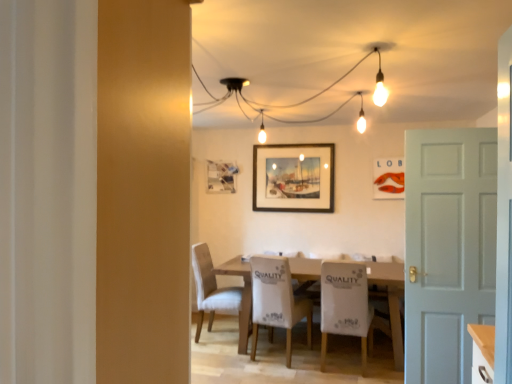
Measure the distance between point [400,265] and camera.

Point [400,265] and camera are 4.19 meters apart from each other.

Measure the distance between point (277, 314) and camera.

The depth of point (277, 314) is 12.40 feet.

The height and width of the screenshot is (384, 512). What do you see at coordinates (277, 301) in the screenshot?
I see `white fabric chair at center, which is the 2th chair from right to left` at bounding box center [277, 301].

In order to face white fabric chair at center, which is the first chair from right to left, should I rotate leftwards or rightwards?

It's best to rotate right around 11.982 degrees.

Locate an element on the screen. matte glass picture frame at center, which is counted as the 1th picture frame, starting from the back is located at coordinates 221,177.

Is matte glass picture frame at center, acting as the 3th picture frame starting from the front, to the left of white matte door at right from the viewer's perspective?

Yes, matte glass picture frame at center, acting as the 3th picture frame starting from the front, is to the left of white matte door at right.

Does point (220, 163) appear closer or farther from the camera than point (453, 159)?

Point (220, 163) is farther from the camera than point (453, 159).

The width and height of the screenshot is (512, 384). What are the coordinates of `the 3rd picture frame positioned above the white matte door at right (from a real-world perspective)` in the screenshot? It's located at (221, 177).

Measure the distance between matte glass picture frame at center, acting as the 3th picture frame starting from the front, and white matte door at right.

A distance of 9.19 feet exists between matte glass picture frame at center, acting as the 3th picture frame starting from the front, and white matte door at right.

Between point (270, 270) and point (210, 174), which one is positioned in front?

The point (270, 270) is closer to the camera.

How many degrees apart are the facing directions of white fabric chair at center, which is the 2th chair from right to left, and matte glass picture frame at center, which is counted as the 1th picture frame, starting from the back?

They differ by 171 degrees in their facing directions.

From a real-world perspective, between white fabric chair at center, placed as the second chair when sorted from left to right, and matte glass picture frame at center, which is counted as the 1th picture frame, starting from the back, who is vertically higher?

matte glass picture frame at center, which is counted as the 1th picture frame, starting from the back.

Could matte glass picture frame at center, acting as the 3th picture frame starting from the front, be considered to be inside white fabric chair at center, placed as the second chair when sorted from left to right?

No, matte glass picture frame at center, acting as the 3th picture frame starting from the front, is located outside of white fabric chair at center, placed as the second chair when sorted from left to right.

Is white fabric chair at center, which is the 2th chair from right to left, taller than white matte door at right?

In fact, white fabric chair at center, which is the 2th chair from right to left, may be shorter than white matte door at right.

Is white fabric chair at center, which is the 2th chair from right to left, in contact with white matte door at right?

No, white fabric chair at center, which is the 2th chair from right to left, is not next to white matte door at right.

Is white fabric chair at center, which is the 2th chair from right to left, not within white matte door at right?

Yes, white fabric chair at center, which is the 2th chair from right to left, is located beyond the bounds of white matte door at right.

From a real-world perspective, is white fabric chair at center, which is the 2th chair from right to left, positioned above or below white matte door at right?

white fabric chair at center, which is the 2th chair from right to left, is situated lower than white matte door at right in the real world.

Which of these two, white fabric chair at center, which is the first chair from right to left, or matte glass picture frame at center, acting as the 3th picture frame starting from the front, is bigger?

With larger size is white fabric chair at center, which is the first chair from right to left.

From a real-world perspective, is white fabric chair at center, which is the first chair from right to left, on top of matte glass picture frame at center, which appears as the third picture frame when viewed from the right?

Actually, white fabric chair at center, which is the first chair from right to left, is physically below matte glass picture frame at center, which appears as the third picture frame when viewed from the right, in the real world.

Where is `the 3rd chair in front of the matte glass picture frame at center, which is counted as the 1th picture frame, starting from the back, starting your count from the anchor`? the 3rd chair in front of the matte glass picture frame at center, which is counted as the 1th picture frame, starting from the back, starting your count from the anchor is located at coordinates (345, 306).

Which object is positioned more to the left, white matte door at right or white fabric chair at center, placed as the second chair when sorted from left to right?

Positioned to the left is white fabric chair at center, placed as the second chair when sorted from left to right.

Consider the image. Is white matte door at right not near white fabric chair at center, which is the 2th chair from right to left?

Absolutely, white matte door at right is distant from white fabric chair at center, which is the 2th chair from right to left.

From a real-world perspective, between white matte door at right and white fabric chair at center, placed as the second chair when sorted from left to right, who is vertically lower?

From a 3D spatial view, white fabric chair at center, placed as the second chair when sorted from left to right, is below.

Where is `door in front of the white fabric chair at center, which is the 2th chair from right to left`? The image size is (512, 384). door in front of the white fabric chair at center, which is the 2th chair from right to left is located at coordinates (448, 248).

Consider the image. Considering the relative sizes of white fabric chair at center, which is the 2th chair from right to left, and wooden framed painting at center, which ranks as the 2th picture frame in front-to-back order, in the image provided, is white fabric chair at center, which is the 2th chair from right to left, bigger than wooden framed painting at center, which ranks as the 2th picture frame in front-to-back order,?

Correct, white fabric chair at center, which is the 2th chair from right to left, is larger in size than wooden framed painting at center, which ranks as the 2th picture frame in front-to-back order.

Considering the relative positions of white fabric chair at center, placed as the second chair when sorted from left to right, and wooden framed painting at center, the second picture frame positioned from the back, in the image provided, is white fabric chair at center, placed as the second chair when sorted from left to right, to the left of wooden framed painting at center, the second picture frame positioned from the back, from the viewer's perspective?

Yes, white fabric chair at center, placed as the second chair when sorted from left to right, is to the left of wooden framed painting at center, the second picture frame positioned from the back.

Which of these two, white fabric chair at center, which is the 2th chair from right to left, or wooden framed painting at center, positioned as the second picture frame in left-to-right order, is thinner?

wooden framed painting at center, positioned as the second picture frame in left-to-right order.

Considering the positions of points (259, 303) and (295, 169), is point (259, 303) closer to camera compared to point (295, 169)?

That is True.

Image resolution: width=512 pixels, height=384 pixels. In order to click on door below the matte glass picture frame at center, acting as the 3th picture frame starting from the front (from the image's perspective) in this screenshot , I will do `click(448, 248)`.

Considering the positions of objects white matte door at right and matte glass picture frame at center, acting as the 3th picture frame starting from the front, in the image provided, who is behind, white matte door at right or matte glass picture frame at center, acting as the 3th picture frame starting from the front,?

matte glass picture frame at center, acting as the 3th picture frame starting from the front, is behind.

Measure the distance between white matte door at right and matte glass picture frame at center, acting as the 3th picture frame starting from the front.

white matte door at right and matte glass picture frame at center, acting as the 3th picture frame starting from the front, are 9.19 feet apart from each other.

Based on the photo, based on their positions, is white matte door at right located to the left or right of matte glass picture frame at center, arranged as the first picture frame when viewed from the left?

Clearly, white matte door at right is on the right of matte glass picture frame at center, arranged as the first picture frame when viewed from the left, in the image.

This screenshot has width=512, height=384. In order to click on door below the matte glass picture frame at center, acting as the 3th picture frame starting from the front (from the image's perspective) in this screenshot , I will do `click(448, 248)`.

From the matte glass picture frame at center, which appears as the third picture frame when viewed from the right, count 2nd chairs forward and point to it. Please provide its 2D coordinates.

[(277, 301)]

Looking at the image, which one is located further to wooden framed painting at center, which ranks as the 2th picture frame in front-to-back order, wooden table at center or white fabric chair at center, which is the first chair from right to left?

white fabric chair at center, which is the first chair from right to left, is further to wooden framed painting at center, which ranks as the 2th picture frame in front-to-back order.

Considering their positions, is light beige fabric chair at center, placed as the third chair when sorted from right to left, positioned closer to wooden framed painting at center, arranged as the second picture frame when viewed from the right, than white matte door at right?

light beige fabric chair at center, placed as the third chair when sorted from right to left.

From the image, which object appears to be nearer to matte orange lobster at upper center, which is the 3th picture frame from back to front, white fabric chair at center, placed as the third chair when sorted from left to right, or light beige fabric chair at center, placed as the third chair when sorted from right to left?

Among the two, white fabric chair at center, placed as the third chair when sorted from left to right, is located nearer to matte orange lobster at upper center, which is the 3th picture frame from back to front.

Looking at the image, which one is located closer to wooden framed painting at center, arranged as the second picture frame when viewed from the right, matte glass picture frame at center, which is counted as the 1th picture frame, starting from the back, or matte orange lobster at upper center, which is the 1th picture frame in front-to-back order?

matte glass picture frame at center, which is counted as the 1th picture frame, starting from the back, is positioned closer to the anchor wooden framed painting at center, arranged as the second picture frame when viewed from the right.

When comparing their distances from matte orange lobster at upper center, which is counted as the 1th picture frame, starting from the right, does matte glass picture frame at center, which is counted as the 1th picture frame, starting from the back, or white matte door at right seem further?

white matte door at right is further to matte orange lobster at upper center, which is counted as the 1th picture frame, starting from the right.

From the image, which object appears to be farther from white fabric chair at center, which is the first chair from right to left, wooden table at center or white matte door at right?

white matte door at right.

Estimate the real-world distances between objects in this image. Which object is further from white matte door at right, white fabric chair at center, which is the 2th chair from right to left, or wooden framed painting at center, which ranks as the 2th picture frame in front-to-back order?

The object further to white matte door at right is wooden framed painting at center, which ranks as the 2th picture frame in front-to-back order.

Based on the photo, looking at the image, which one is located closer to matte glass picture frame at center, arranged as the first picture frame when viewed from the left, white fabric chair at center, which is the 2th chair from right to left, or wooden framed painting at center, arranged as the second picture frame when viewed from the right?

wooden framed painting at center, arranged as the second picture frame when viewed from the right, is closer to matte glass picture frame at center, arranged as the first picture frame when viewed from the left.

The height and width of the screenshot is (384, 512). I want to click on table between white fabric chair at center, which is the first chair from right to left, and matte glass picture frame at center, which appears as the third picture frame when viewed from the right, along the z-axis, so pos(392,301).

Where is `chair between matte orange lobster at upper center, which is the 1th picture frame in front-to-back order, and white fabric chair at center, placed as the third chair when sorted from left to right, vertically`? The height and width of the screenshot is (384, 512). chair between matte orange lobster at upper center, which is the 1th picture frame in front-to-back order, and white fabric chair at center, placed as the third chair when sorted from left to right, vertically is located at coordinates (277, 301).

The width and height of the screenshot is (512, 384). In order to click on table located between light beige fabric chair at center, placed as the third chair when sorted from right to left, and white fabric chair at center, placed as the third chair when sorted from left to right, in the left-right direction in this screenshot , I will do `click(392, 301)`.

At what (x,y) coordinates should I click in order to perform the action: click on picture frame situated between matte glass picture frame at center, which is counted as the 1th picture frame, starting from the back, and matte orange lobster at upper center, which is the 3th picture frame from back to front, from left to right. Please return your answer as a coordinate pair (x, y). The height and width of the screenshot is (384, 512). Looking at the image, I should click on (293, 178).